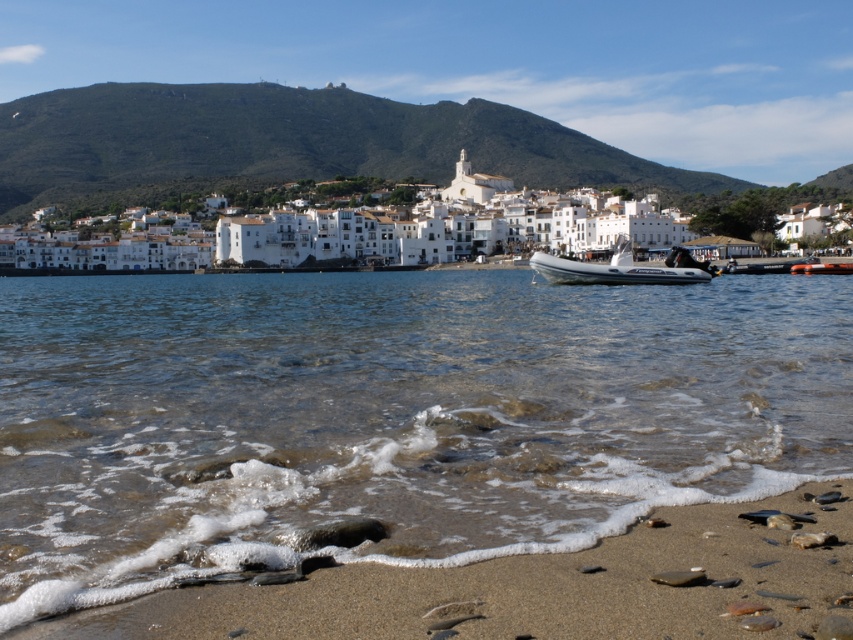
Between sandy brown at lower center and white matte buildings at center, which one is positioned higher?

white matte buildings at center is above.

Can you confirm if sandy brown at lower center is positioned to the right of white matte buildings at center?

Yes, sandy brown at lower center is to the right of white matte buildings at center.

Where is `sandy brown at lower center`? This screenshot has width=853, height=640. sandy brown at lower center is located at coordinates (532, 589).

Based on the photo, is white matte buildings at center to the right of white rubber boat at center from the viewer's perspective?

No, white matte buildings at center is not to the right of white rubber boat at center.

Between white matte buildings at center and white rubber boat at center, which one is positioned higher?

white matte buildings at center

Is point (270, 256) less distant than point (538, 264)?

No, (270, 256) is behind (538, 264).

This screenshot has height=640, width=853. Find the location of `white matte buildings at center`. white matte buildings at center is located at coordinates (274, 252).

Is clear water at beach center positioned before sandy brown at lower center?

No.

Between point (305, 301) and point (744, 560), which one is positioned in front?

Point (744, 560) is in front.

The height and width of the screenshot is (640, 853). What do you see at coordinates (390, 413) in the screenshot?
I see `clear water at beach center` at bounding box center [390, 413].

The height and width of the screenshot is (640, 853). Identify the location of clear water at beach center. (390, 413).